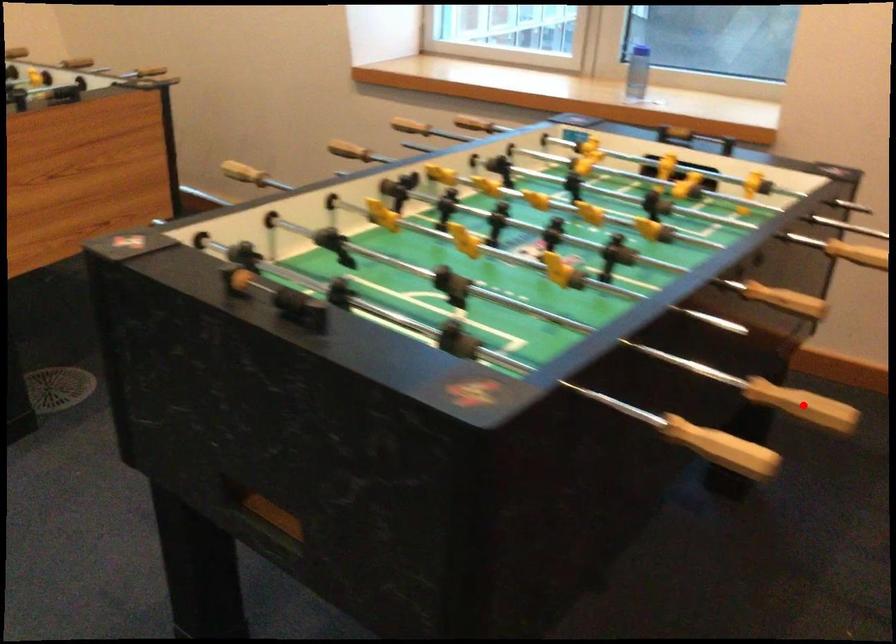
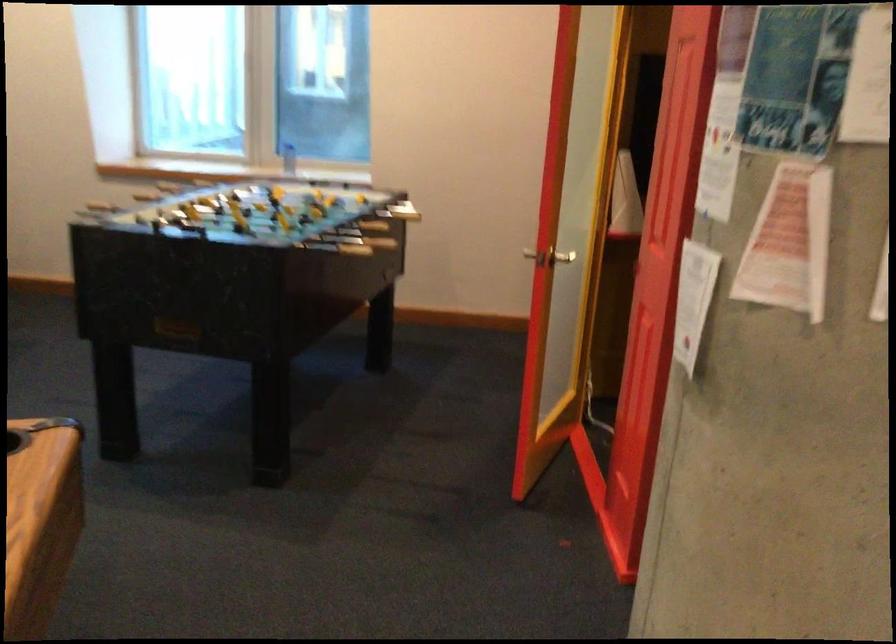
Question: I am providing you with two images of the same scene from different viewpoints. A red point is shown in image1. For the corresponding object point in image2, is it positioned nearer or farther from the camera?

Choices:
 (A) Nearer
 (B) Farther

Answer: (B)